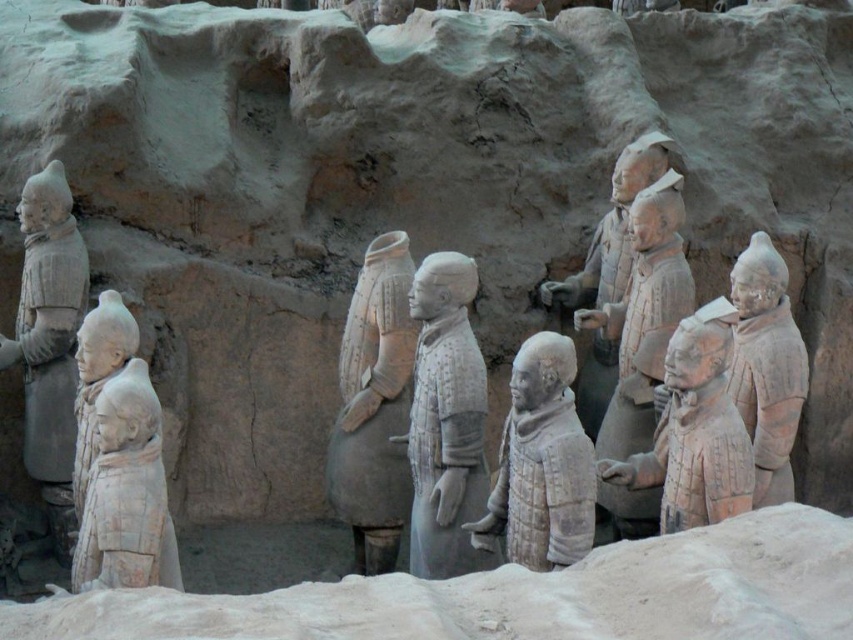
You are an archaeologist standing in front of the terracotta warriors. You need to locate the earthenware armor at center. Based on the coordinates provided, where should you look relative to the center of the image?

The earthenware armor at center is located at coordinates point [374,406], which means it is slightly to the right and above the center point of the image.

You are an archaeologist examining the terracotta warriors. You notice the white matte armor at center and the white matte terracotta warrior at center. Which object is closer to you?

The white matte armor at center is closer to you because the white matte terracotta warrior at center is behind it.

You are an archaeologist examining the terracotta warriors. You notice the white matte armor at center and the white matte terracotta warrior at center. Which object is located below the other?

The white matte armor at center is positioned under the white matte terracotta warrior at center, so the armor is below the warrior.